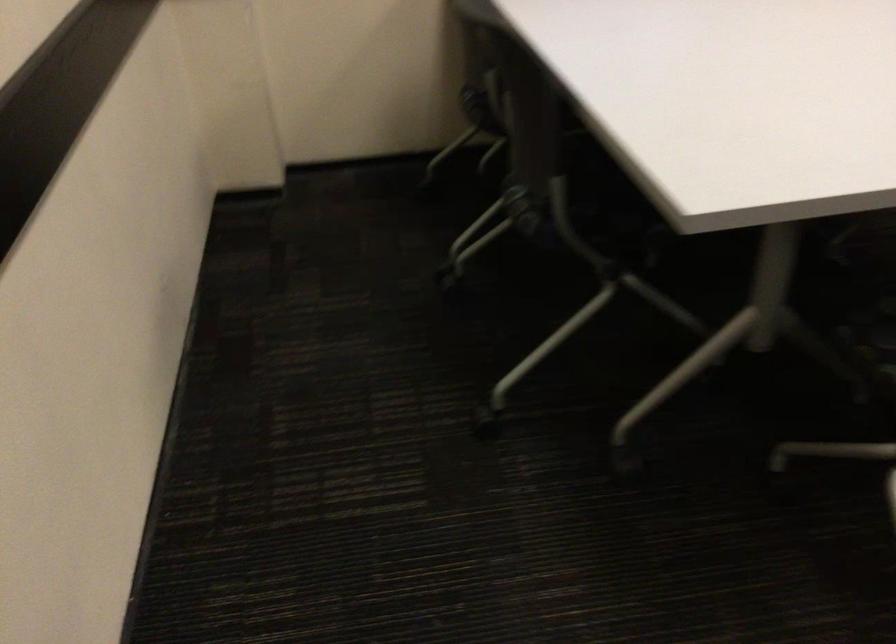
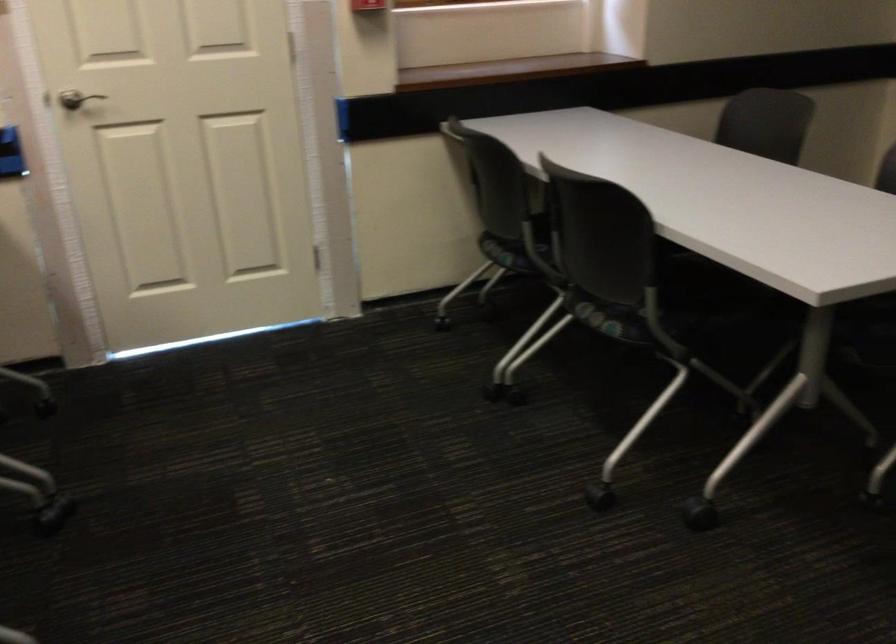
Question: What movement of the cameraman would produce the second image?

Choices:
 (A) Left
 (B) Right
 (C) Forward
 (D) Backward

Answer: (B)